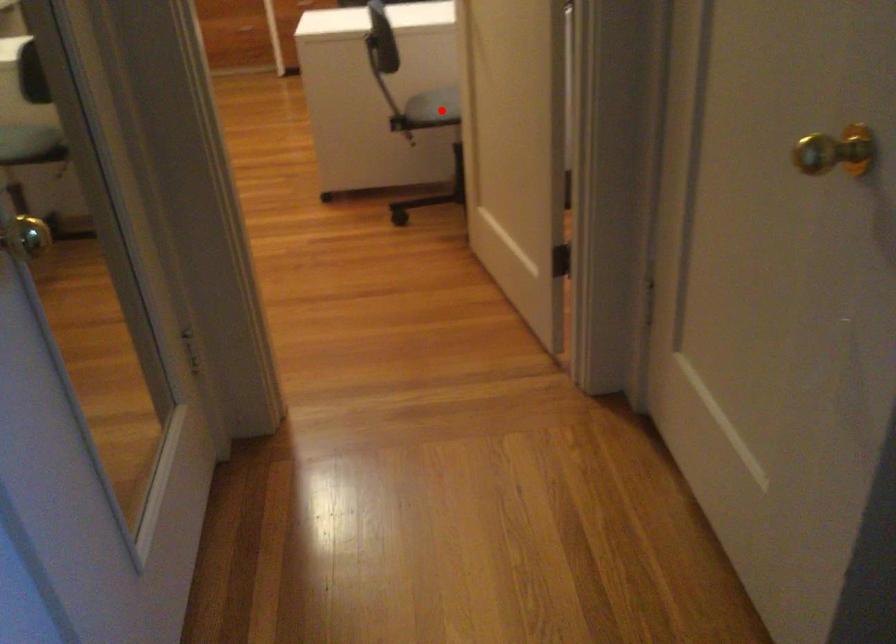
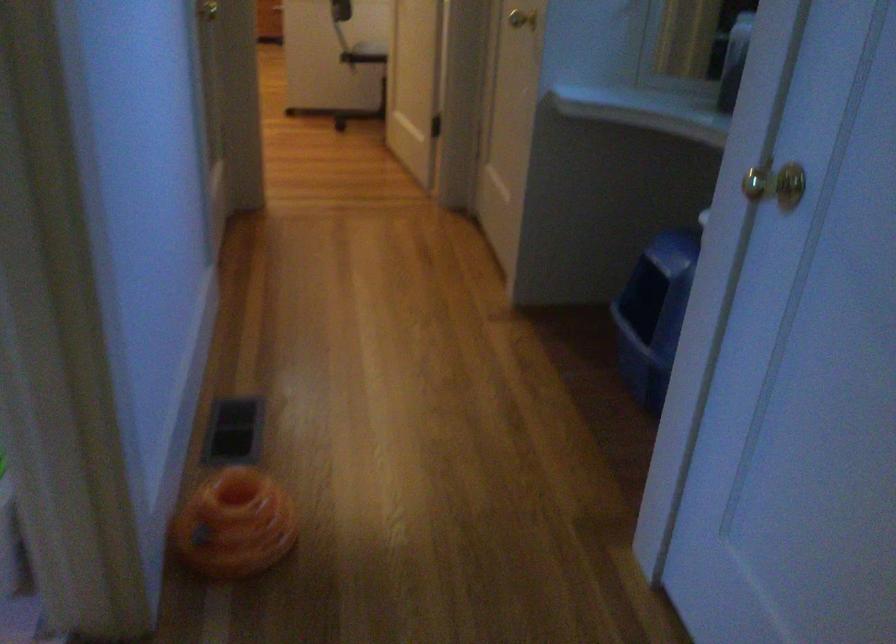
Question: A red point is marked in image1. In image2, is the corresponding 3D point closer to the camera or farther? Reply with the corresponding letter.

Choices:
 (A) The corresponding 3D point is closer.
 (B) The corresponding 3D point is farther.

Answer: (B)